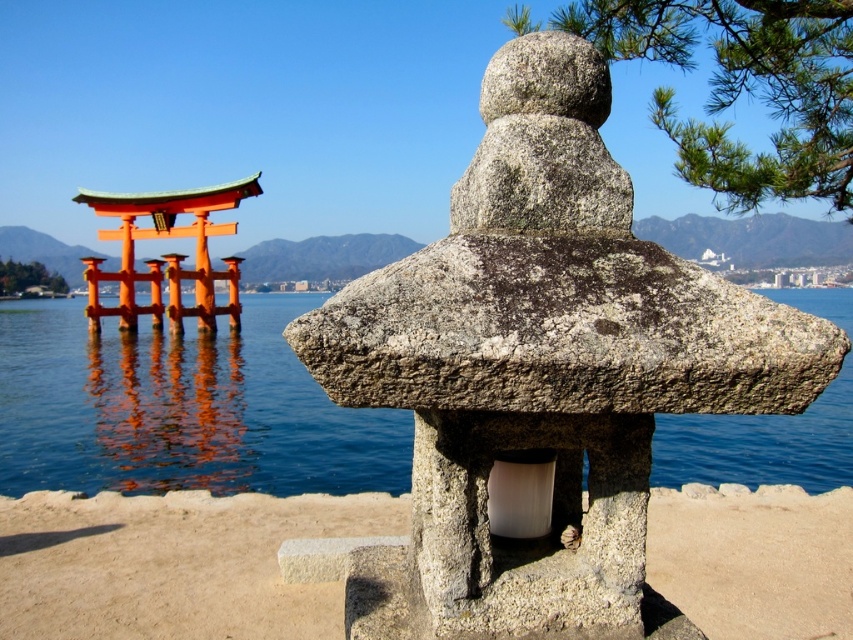
Can you confirm if smooth concrete base at center is wider than orange painted wood torii gate at left?

In fact, smooth concrete base at center might be narrower than orange painted wood torii gate at left.

Who is more forward, (186, 552) or (126, 275)?

Point (186, 552) is in front.

I want to click on smooth concrete base at center, so click(x=173, y=564).

Which of these two, gray stone lantern at center or smooth concrete base at center, stands shorter?

smooth concrete base at center is shorter.

Which is in front, point (809, 339) or point (790, 605)?

Positioned in front is point (809, 339).

I want to click on gray stone lantern at center, so click(543, 365).

Who is shorter, blue water at center or smooth concrete base at center?

smooth concrete base at center is shorter.

Who is more forward, (212,401) or (392,504)?

Positioned in front is point (392,504).

This screenshot has height=640, width=853. Describe the element at coordinates (181, 410) in the screenshot. I see `blue water at center` at that location.

This screenshot has width=853, height=640. I want to click on blue water at center, so click(x=181, y=410).